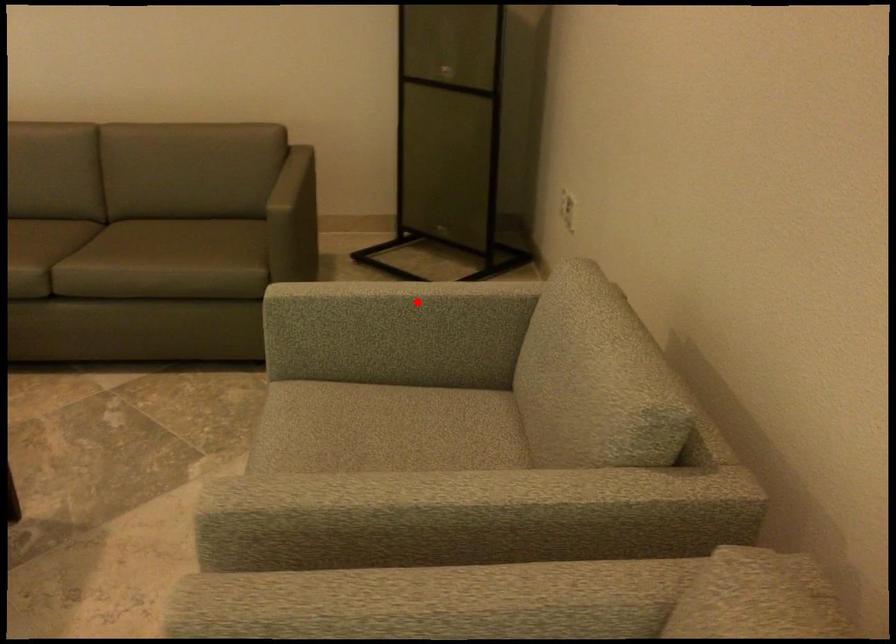
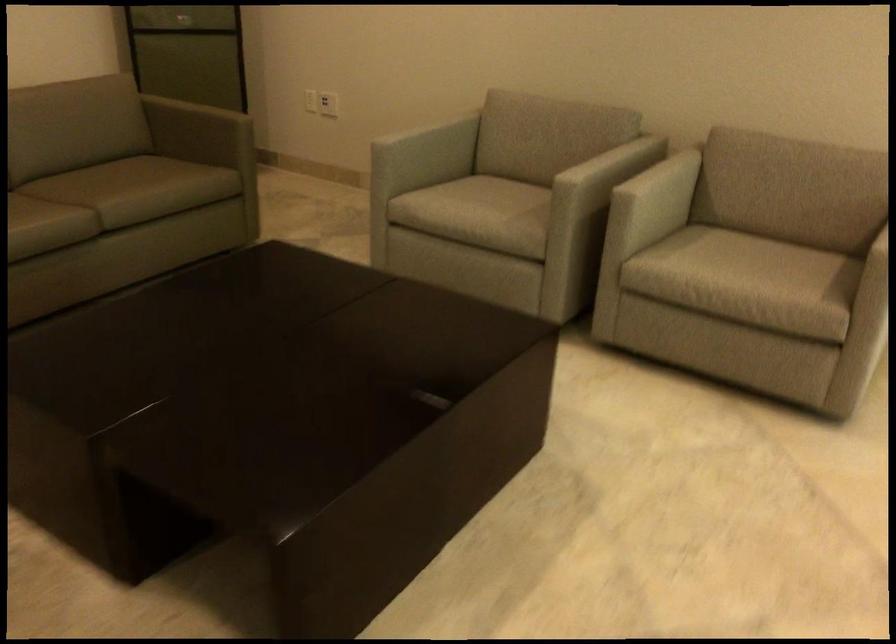
Find the pixel in the second image that matches the highlighted location in the first image.

(423, 127)